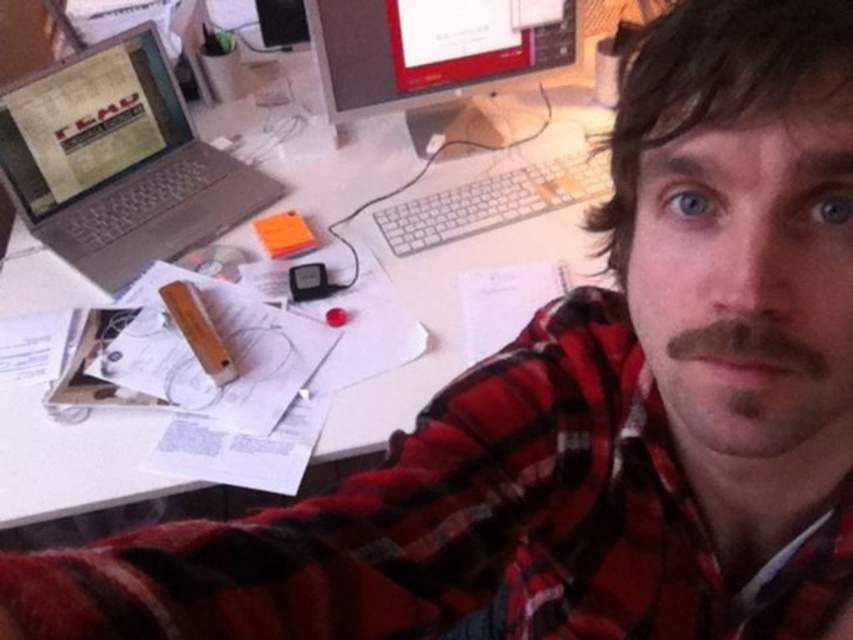
Question: Which point appears closest to the camera in this image?

Choices:
 (A) (428, 13)
 (B) (666, 440)
 (C) (44, 129)
 (D) (125, 483)

Answer: (B)

Question: Is the position of red plaid shirt at center less distant than that of white paper at upper center?

Choices:
 (A) no
 (B) yes

Answer: (B)

Question: Which point is closer to the camera?

Choices:
 (A) matte black monitor at upper center
 (B) silver metallic laptop at left
 (C) red plaid shirt at center

Answer: (C)

Question: Can you confirm if silver metallic laptop at left is positioned to the left of matte black monitor at upper center?

Choices:
 (A) yes
 (B) no

Answer: (A)

Question: Which point is farther from the camera taking this photo?

Choices:
 (A) (381, 122)
 (B) (430, 54)
 (C) (112, 195)
 (D) (447, 404)

Answer: (A)

Question: Is red plaid shirt at center positioned before white paper at upper center?

Choices:
 (A) no
 (B) yes

Answer: (B)